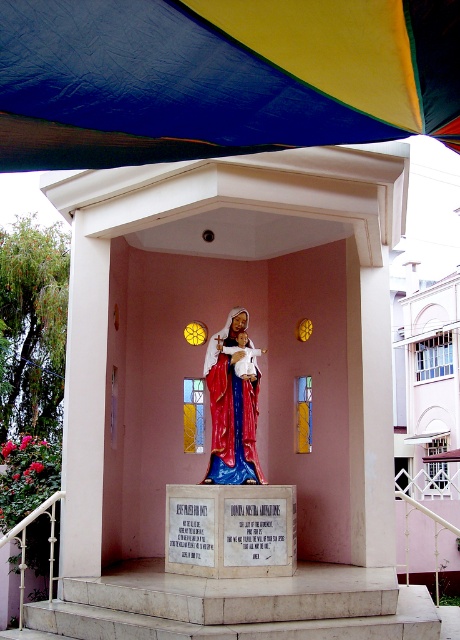
Can you confirm if textured canvas canopy at upper center is positioned to the right of polished wood statue at center?

In fact, textured canvas canopy at upper center is to the left of polished wood statue at center.

Can you confirm if textured canvas canopy at upper center is shorter than polished wood statue at center?

Yes, textured canvas canopy at upper center is shorter than polished wood statue at center.

The height and width of the screenshot is (640, 460). What do you see at coordinates (219, 77) in the screenshot?
I see `textured canvas canopy at upper center` at bounding box center [219, 77].

You are a GUI agent. You are given a task and a screenshot of the screen. Output one action in this format:
    pyautogui.click(x=<x>, y=<y>)
    Task: Click on the textured canvas canopy at upper center
    Image resolution: width=460 pixels, height=640 pixels.
    Given the screenshot: What is the action you would take?
    pyautogui.click(x=219, y=77)

How much distance is there between white marble stairs at center and polished wood statue at center?

white marble stairs at center is 7.22 feet away from polished wood statue at center.

Between white marble stairs at center and polished wood statue at center, which one is positioned lower?

white marble stairs at center is lower down.

The width and height of the screenshot is (460, 640). I want to click on white marble stairs at center, so click(x=230, y=624).

At what (x,y) coordinates should I click in order to perform the action: click on white marble stairs at center. Please return your answer as a coordinate pair (x, y). The image size is (460, 640). Looking at the image, I should click on (230, 624).

Is point (344, 131) less distant than point (111, 637)?

Yes, point (344, 131) is closer to viewer.

Is textured canvas canopy at upper center bigger than white marble stairs at center?

No, textured canvas canopy at upper center is not bigger than white marble stairs at center.

I want to click on textured canvas canopy at upper center, so click(x=219, y=77).

The image size is (460, 640). What are the coordinates of `textured canvas canopy at upper center` in the screenshot? It's located at (219, 77).